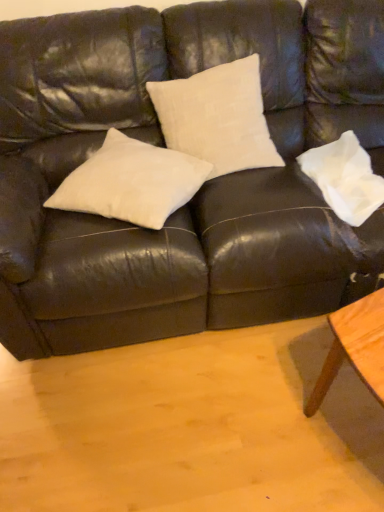
Measure the distance between point (158,321) and camera.

The depth of point (158,321) is 1.47 meters.

What are the coordinates of `matte black leather couch at center` in the screenshot? It's located at (202, 187).

From a real-world perspective, is white cotton pillow at right, marked as the 1th pillow in a right-to-left arrangement, beneath white cotton pillow at center, the first pillow in the left-to-right sequence?

Yes.

Is white cotton pillow at right, marked as the 1th pillow in a right-to-left arrangement, far away from white cotton pillow at center, the first pillow in the left-to-right sequence?

That's not correct — white cotton pillow at right, marked as the 1th pillow in a right-to-left arrangement, is a little close to white cotton pillow at center, the first pillow in the left-to-right sequence.

Is white cotton pillow at right, marked as the 1th pillow in a right-to-left arrangement, situated inside white cotton pillow at center, placed as the 2th pillow when sorted from right to left, or outside?

white cotton pillow at right, marked as the 1th pillow in a right-to-left arrangement, cannot be found inside white cotton pillow at center, placed as the 2th pillow when sorted from right to left.

From the image's perspective, which one is positioned higher, white cotton pillow at right, marked as the 1th pillow in a right-to-left arrangement, or matte black leather couch at center?

From the image's view, matte black leather couch at center is above.

Are white cotton pillow at right, the 2th pillow viewed from the left, and matte black leather couch at center making contact?

No, white cotton pillow at right, the 2th pillow viewed from the left, is not in contact with matte black leather couch at center.

From a real-world perspective, who is located lower, white cotton pillow at right, the 2th pillow viewed from the left, or matte black leather couch at center?

From a 3D spatial view, white cotton pillow at right, the 2th pillow viewed from the left, is below.

What's the angular difference between white cotton pillow at right, the 2th pillow viewed from the left, and matte black leather couch at center's facing directions?

The angle between the facing direction of white cotton pillow at right, the 2th pillow viewed from the left, and the facing direction of matte black leather couch at center is 6.31 degrees.

From the image's perspective, which object appears higher, white cotton pillow at center, the first pillow in the left-to-right sequence, or matte black leather couch at center?

matte black leather couch at center appears higher in the image.

Considering the relative sizes of white cotton pillow at center, the first pillow in the left-to-right sequence, and matte black leather couch at center in the image provided, is white cotton pillow at center, the first pillow in the left-to-right sequence, shorter than matte black leather couch at center?

Yes, white cotton pillow at center, the first pillow in the left-to-right sequence, is shorter than matte black leather couch at center.

In terms of width, does white cotton pillow at center, placed as the 2th pillow when sorted from right to left, look wider or thinner when compared to matte black leather couch at center?

white cotton pillow at center, placed as the 2th pillow when sorted from right to left, is thinner than matte black leather couch at center.

From a real-world perspective, who is located higher, white cotton pillow at center, placed as the 2th pillow when sorted from right to left, or matte black leather couch at center?

white cotton pillow at center, placed as the 2th pillow when sorted from right to left.

Based on their sizes in the image, would you say white cotton pillow at center, placed as the 2th pillow when sorted from right to left, is bigger or smaller than white cotton pillow at right, marked as the 1th pillow in a right-to-left arrangement?

white cotton pillow at center, placed as the 2th pillow when sorted from right to left, is bigger than white cotton pillow at right, marked as the 1th pillow in a right-to-left arrangement.

Considering the positions of objects white cotton pillow at center, the first pillow in the left-to-right sequence, and white cotton pillow at right, marked as the 1th pillow in a right-to-left arrangement, in the image provided, who is in front, white cotton pillow at center, the first pillow in the left-to-right sequence, or white cotton pillow at right, marked as the 1th pillow in a right-to-left arrangement,?

white cotton pillow at center, the first pillow in the left-to-right sequence.

From the image's perspective, is white cotton pillow at center, placed as the 2th pillow when sorted from right to left, located above or below white cotton pillow at right, the 2th pillow viewed from the left?

white cotton pillow at center, placed as the 2th pillow when sorted from right to left, is below white cotton pillow at right, the 2th pillow viewed from the left.

Considering the points (87, 169) and (352, 220), which point is behind, point (87, 169) or point (352, 220)?

Point (87, 169)

Does point (303, 147) lie behind point (153, 177)?

That is True.

Considering the relative positions of matte black leather couch at center and white cotton pillow at center, the first pillow in the left-to-right sequence, in the image provided, is matte black leather couch at center to the left of white cotton pillow at center, the first pillow in the left-to-right sequence, from the viewer's perspective?

No.

Would you say matte black leather couch at center is a long distance from white cotton pillow at center, placed as the 2th pillow when sorted from right to left?

No, matte black leather couch at center is not far from white cotton pillow at center, placed as the 2th pillow when sorted from right to left.

From a real-world perspective, between matte black leather couch at center and white cotton pillow at center, the first pillow in the left-to-right sequence, who is vertically higher?

white cotton pillow at center, the first pillow in the left-to-right sequence, from a real-world perspective.

What's the angular difference between matte black leather couch at center and white cotton pillow at right, marked as the 1th pillow in a right-to-left arrangement,'s facing directions?

The angular difference between matte black leather couch at center and white cotton pillow at right, marked as the 1th pillow in a right-to-left arrangement, is 6.31 degrees.

Which object is further away from the camera taking this photo, matte black leather couch at center or white cotton pillow at right, marked as the 1th pillow in a right-to-left arrangement?

white cotton pillow at right, marked as the 1th pillow in a right-to-left arrangement, is more distant.

Is matte black leather couch at center not near white cotton pillow at right, marked as the 1th pillow in a right-to-left arrangement?

No, there isn't a large distance between matte black leather couch at center and white cotton pillow at right, marked as the 1th pillow in a right-to-left arrangement.

The image size is (384, 512). I want to click on pillow in front of the white cotton pillow at right, the 2th pillow viewed from the left, so click(x=131, y=182).

The width and height of the screenshot is (384, 512). Identify the location of studio couch above the white cotton pillow at right, marked as the 1th pillow in a right-to-left arrangement (from the image's perspective). (202, 187).

When comparing their distances from matte black leather couch at center, does white cotton pillow at right, marked as the 1th pillow in a right-to-left arrangement, or white cotton pillow at center, placed as the 2th pillow when sorted from right to left, seem further?

The object further to matte black leather couch at center is white cotton pillow at right, marked as the 1th pillow in a right-to-left arrangement.

When comparing their distances from white cotton pillow at right, the 2th pillow viewed from the left, does matte black leather couch at center or white cotton pillow at center, the first pillow in the left-to-right sequence, seem further?

white cotton pillow at center, the first pillow in the left-to-right sequence, lies further to white cotton pillow at right, the 2th pillow viewed from the left, than the other object.

When comparing their distances from white cotton pillow at center, placed as the 2th pillow when sorted from right to left, does white cotton pillow at right, the 2th pillow viewed from the left, or matte black leather couch at center seem further?

Among the two, white cotton pillow at right, the 2th pillow viewed from the left, is located further to white cotton pillow at center, placed as the 2th pillow when sorted from right to left.

From the image, which object appears to be nearer to white cotton pillow at right, marked as the 1th pillow in a right-to-left arrangement, white cotton pillow at center, the first pillow in the left-to-right sequence, or matte black leather couch at center?

matte black leather couch at center is positioned closer to the anchor white cotton pillow at right, marked as the 1th pillow in a right-to-left arrangement.

From the picture: Estimate the real-world distances between objects in this image. Which object is closer to matte black leather couch at center, white cotton pillow at center, the first pillow in the left-to-right sequence, or white cotton pillow at right, marked as the 1th pillow in a right-to-left arrangement?

white cotton pillow at center, the first pillow in the left-to-right sequence, is positioned closer to the anchor matte black leather couch at center.

Estimate the real-world distances between objects in this image. Which object is further from white cotton pillow at center, the first pillow in the left-to-right sequence, matte black leather couch at center or white cotton pillow at right, the 2th pillow viewed from the left?

Based on the image, white cotton pillow at right, the 2th pillow viewed from the left, appears to be further to white cotton pillow at center, the first pillow in the left-to-right sequence.

You are a GUI agent. You are given a task and a screenshot of the screen. Output one action in this format:
    pyautogui.click(x=<x>, y=<y>)
    Task: Click on the studio couch located between white cotton pillow at center, placed as the 2th pillow when sorted from right to left, and white cotton pillow at right, the 2th pillow viewed from the left, in the left-right direction
    This screenshot has width=384, height=512.
    Given the screenshot: What is the action you would take?
    pyautogui.click(x=202, y=187)